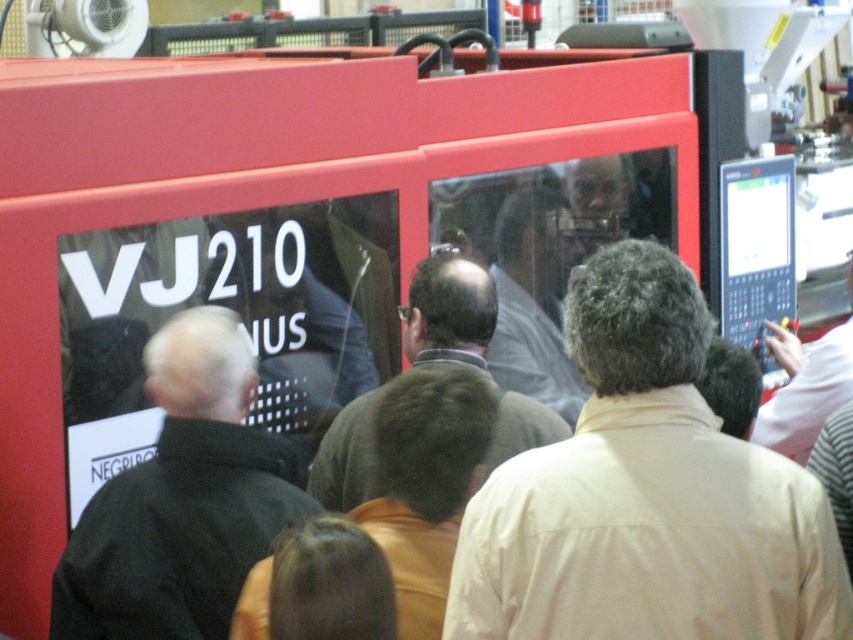
Question: Does dark brown sweater at center come in front of black plastic computer screen at right?

Choices:
 (A) yes
 (B) no

Answer: (A)

Question: Which of these objects is positioned closest to the black matte jacket at left?

Choices:
 (A) light gray shirt at center
 (B) black plastic computer screen at right
 (C) beige fabric shirt at center

Answer: (C)

Question: Is black matte jacket at left behind black plastic computer screen at right?

Choices:
 (A) no
 (B) yes

Answer: (A)

Question: Which point is closer to the camera taking this photo?

Choices:
 (A) (776, 164)
 (B) (804, 611)
 (C) (523, 339)
 (D) (138, 481)

Answer: (B)

Question: Does dark brown sweater at center have a lesser width compared to light gray shirt at center?

Choices:
 (A) yes
 (B) no

Answer: (B)

Question: Among these points, which one is farthest from the camera?

Choices:
 (A) (543, 212)
 (B) (840, 595)
 (C) (730, 246)

Answer: (C)